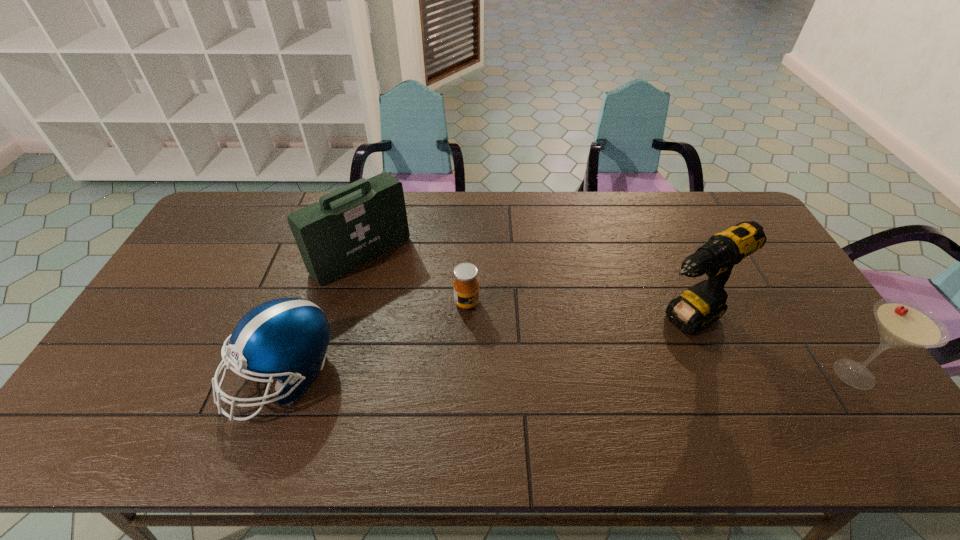
Locate an element on the screen. object present at the right edge is located at coordinates click(902, 324).

Find the location of a particular element. Image resolution: width=960 pixels, height=540 pixels. object that is at the near right corner is located at coordinates (902, 324).

Locate an element on the screen. This screenshot has height=540, width=960. vacant space at the far edge is located at coordinates (413, 205).

This screenshot has width=960, height=540. In the image, there is a desktop. Find the location of `vacant space at the near edge`. vacant space at the near edge is located at coordinates (317, 396).

This screenshot has width=960, height=540. I want to click on vacant area at the left edge of the desktop, so click(x=202, y=268).

Image resolution: width=960 pixels, height=540 pixels. In order to click on vacant space at the right edge of the desktop in this screenshot , I will do `click(774, 312)`.

This screenshot has height=540, width=960. In order to click on vacant region at the far left corner of the desktop in this screenshot , I will do `click(230, 215)`.

Locate an element on the screen. vacant space that is in between the football helmet and the shortest object is located at coordinates (375, 339).

Locate an element on the screen. This screenshot has width=960, height=540. free space between the football helmet and the rightmost object is located at coordinates (568, 375).

Where is `vacant area that lies between the football helmet and the rightmost object`? The height and width of the screenshot is (540, 960). vacant area that lies between the football helmet and the rightmost object is located at coordinates (568, 375).